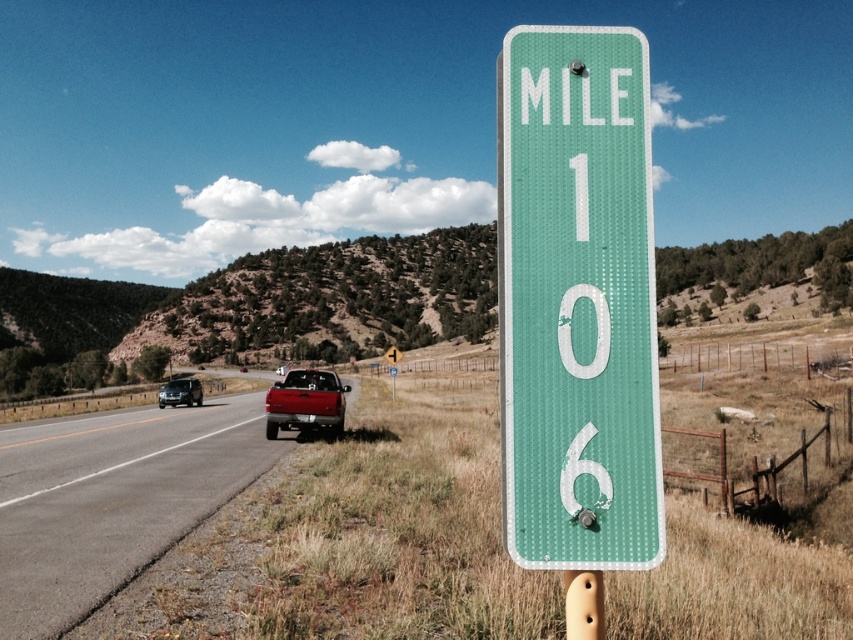
You are a pedestrian standing at the roadside and want to cross the road safely. The road has two lanes. There is a matte red truck at center and a green textured pole at center. Which object should you avoid while crossing to stay safe?

The matte red truck at center is positioned under the green textured pole at center, so you should avoid the matte red truck at center while crossing the road to stay safe.

You are standing at the roadside and want to take a photo of the green textured sign at center. If your camera can focus on objects up to 2 meters away, will it be able to capture the sign clearly?

The green textured sign at center is 2.25 meters from camera, so it is slightly out of the camera focus range. The camera cannot capture the sign clearly.